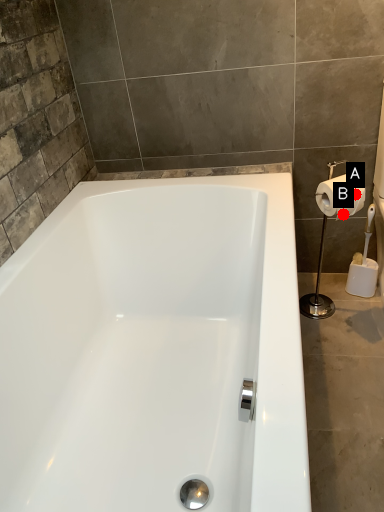
Question: Two points are circled on the image, labeled by A and B beside each circle. Which of the following is the closest to the observer?

Choices:
 (A) A is closer
 (B) B is closer

Answer: (A)